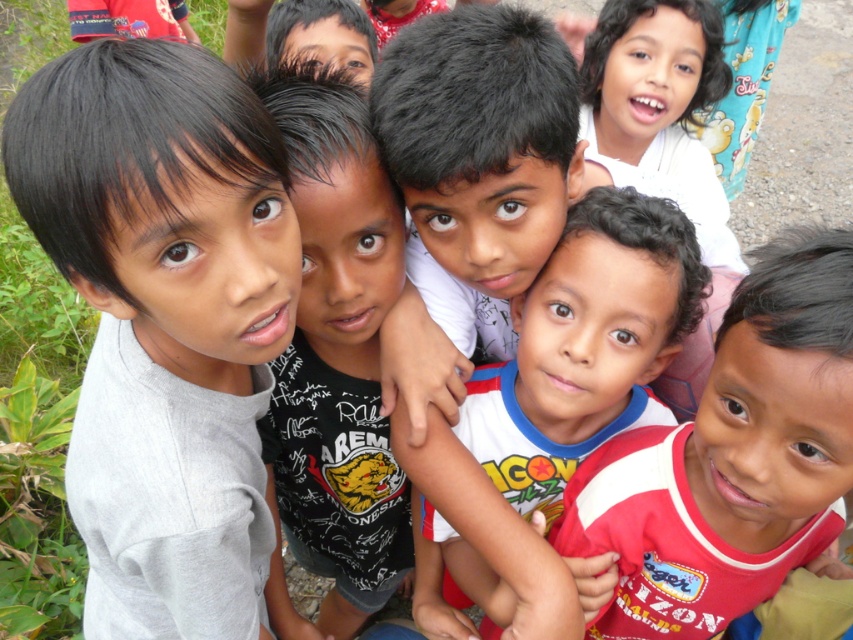
This screenshot has width=853, height=640. What are the coordinates of `red cotton shirt at center` in the screenshot? It's located at (732, 458).

Is red cotton shirt at center thinner than black printed t-shirt at center?

No.

Is point (805, 445) farther from viewer compared to point (361, 435)?

That is False.

Locate an element on the screen. This screenshot has width=853, height=640. red cotton shirt at center is located at coordinates (732, 458).

Does gray matte shirt at left come in front of red cotton shirt at center?

Yes, gray matte shirt at left is in front of red cotton shirt at center.

Describe the element at coordinates (164, 321) in the screenshot. Image resolution: width=853 pixels, height=640 pixels. I see `gray matte shirt at left` at that location.

At what (x,y) coordinates should I click in order to perform the action: click on gray matte shirt at left. Please return your answer as a coordinate pair (x, y). The height and width of the screenshot is (640, 853). Looking at the image, I should click on (164, 321).

Measure the distance between point (273,627) and camera.

1.62 meters

Which is in front, point (370, 230) or point (570, 442)?

Point (370, 230)

Where is `black printed t-shirt at center`? This screenshot has height=640, width=853. black printed t-shirt at center is located at coordinates (334, 362).